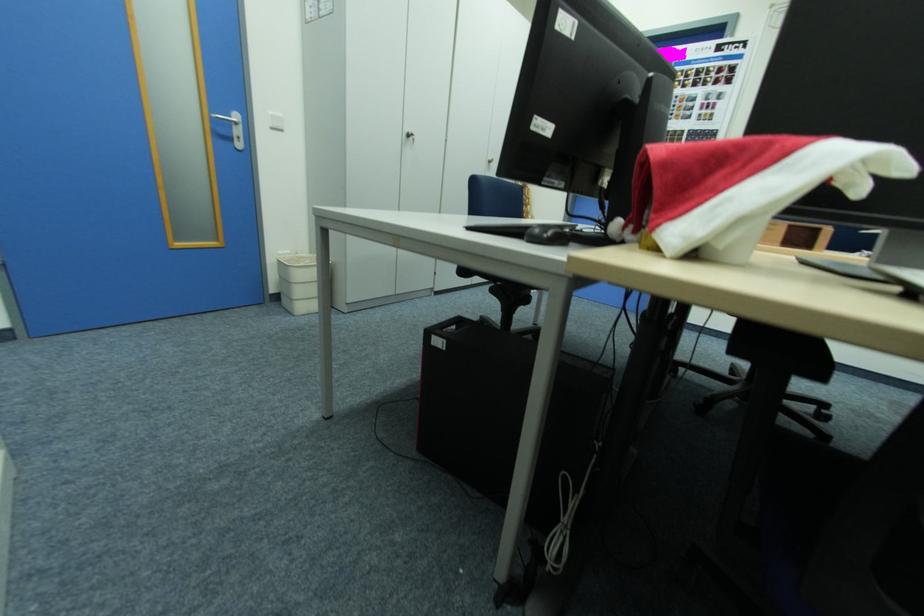
Where is `black computer tower`? This screenshot has width=924, height=616. black computer tower is located at coordinates (504, 411).